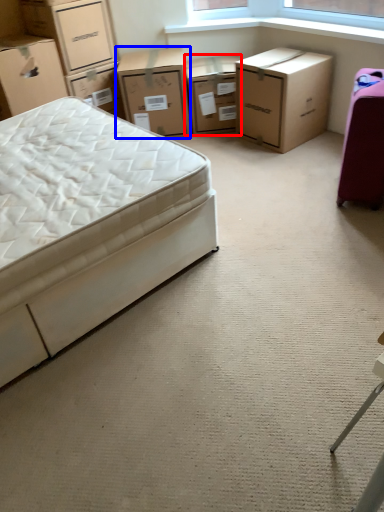
Question: Which of the following is the closest to the observer, chest of drawers (highlighted by a red box) or chest of drawers (highlighted by a blue box)?

Choices:
 (A) chest of drawers
 (B) chest of drawers

Answer: (B)